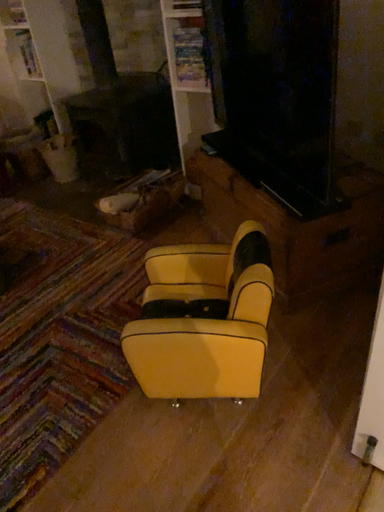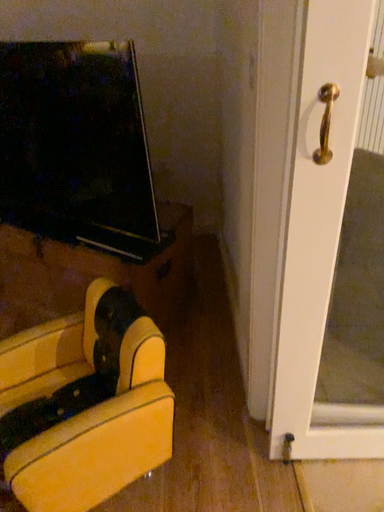
Question: Which way did the camera rotate in the video?

Choices:
 (A) rotated right
 (B) rotated left

Answer: (A)